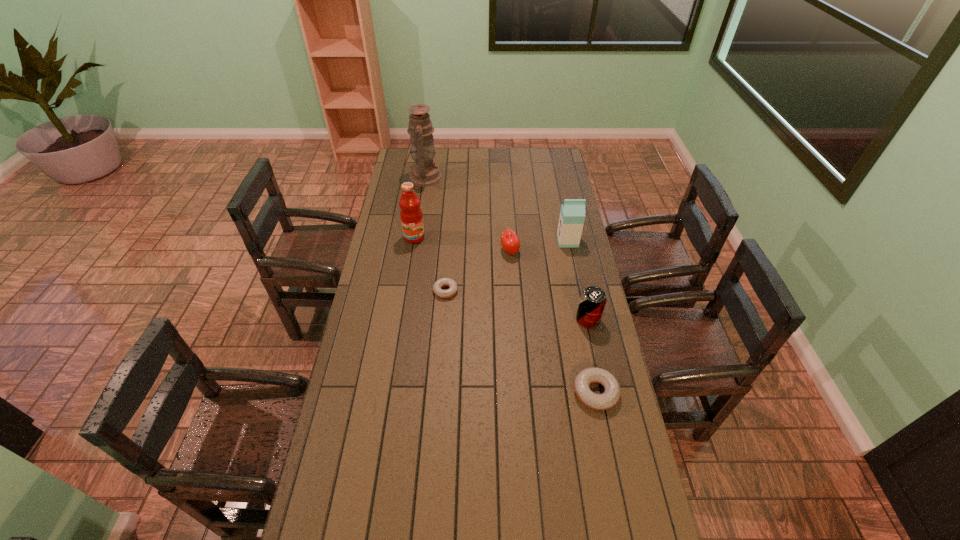
The height and width of the screenshot is (540, 960). Identify the location of the sixth closest object to the sixth shortest object. (611, 395).

Locate an element on the screen. This screenshot has width=960, height=540. free space in the image that satisfies the following two spatial constraints: 1. on the front label of the fruit juice; 2. on the right side of the fourth object from left to right is located at coordinates (412, 251).

What are the coordinates of `vacant space that satisfies the following two spatial constraints: 1. on the front side of the shorter doughnut; 2. on the right side of the right doughnut` in the screenshot? It's located at (438, 392).

In order to click on vacant space that satisfies the following two spatial constraints: 1. on the front side of the farther doughnut; 2. on the left side of the sixth tallest object in this screenshot , I will do [x=438, y=392].

Identify the location of free point that satisfies the following two spatial constraints: 1. on the front label of the fourth object from right to left; 2. on the left side of the second tallest object. This screenshot has width=960, height=540. coord(412,251).